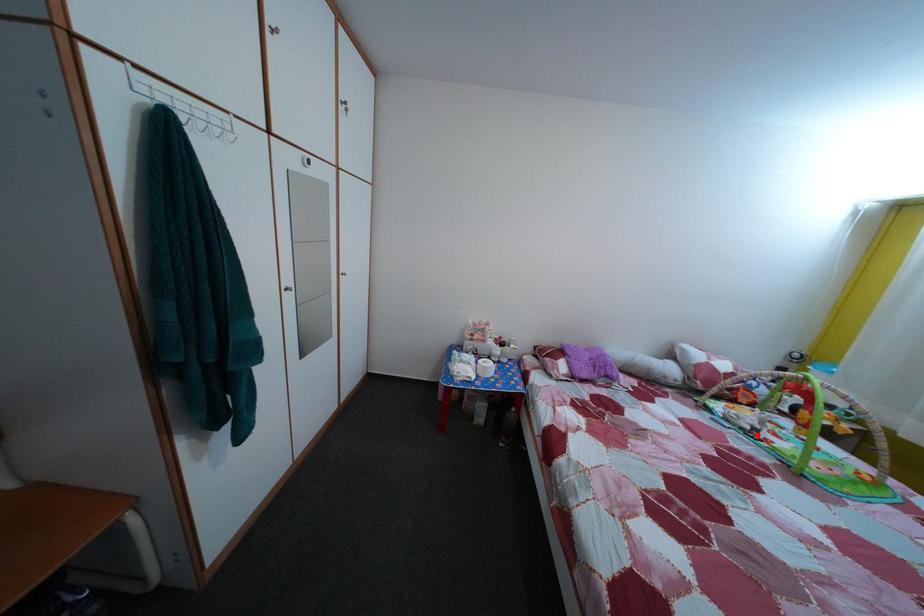
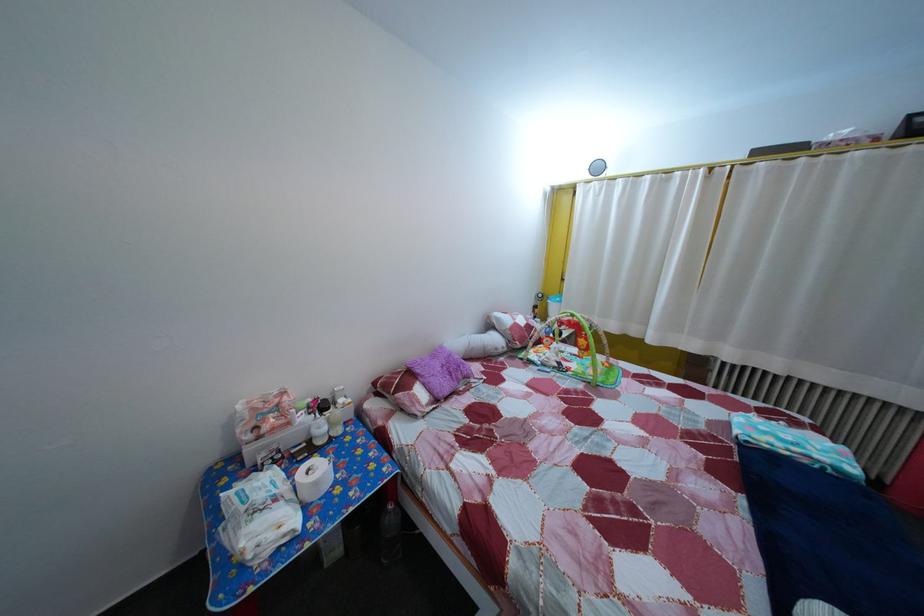
The point at the highlighted location is marked in the first image. Where is the corresponding point in the second image?

(565, 371)